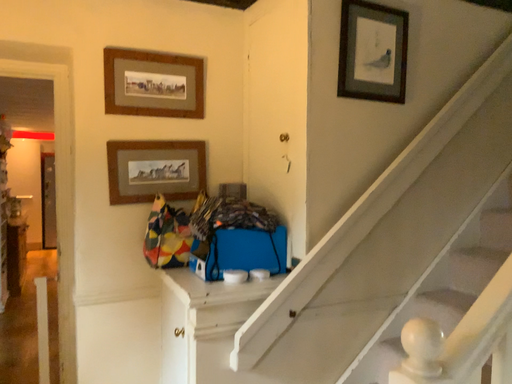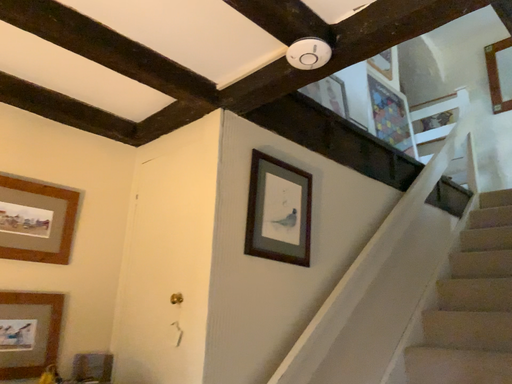
Question: How did the camera likely rotate when shooting the video?

Choices:
 (A) rotated upward
 (B) rotated downward

Answer: (A)